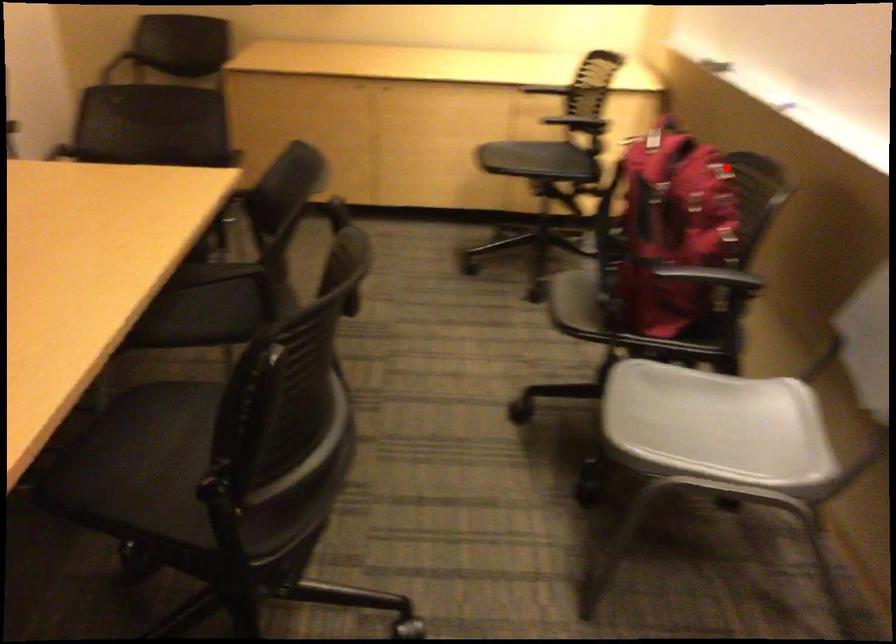
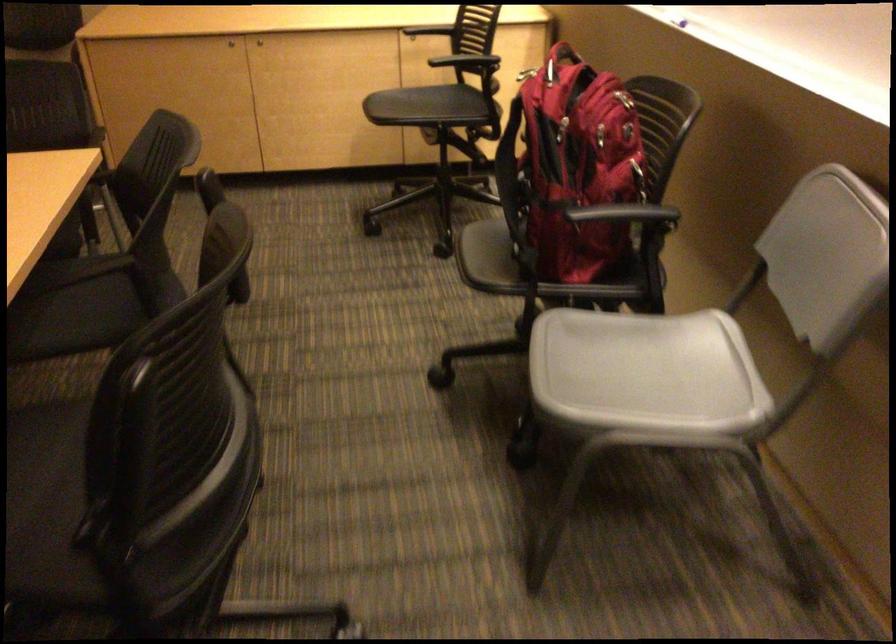
Question: I am providing you with two images of the same scene from different viewpoints. A red point is marked on the first image. Is the red point's position out of view in image 2?

Choices:
 (A) Yes
 (B) No

Answer: (B)